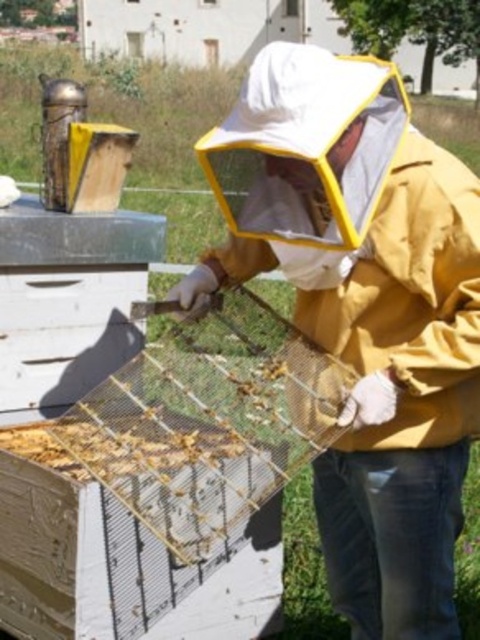
Question: Which of the following is the farthest from the observer?

Choices:
 (A) wooden frame at center
 (B) yellow matte beekeeper suit at center

Answer: (A)

Question: Does yellow matte beekeeper suit at center have a larger size compared to wooden frame at center?

Choices:
 (A) no
 (B) yes

Answer: (B)

Question: Which of the following is the farthest from the observer?

Choices:
 (A) (214, 561)
 (B) (248, 76)

Answer: (A)

Question: Which point is closer to the camera taking this photo?

Choices:
 (A) (171, 353)
 (B) (204, 273)

Answer: (B)

Question: Does yellow matte beekeeper suit at center have a larger size compared to wooden frame at center?

Choices:
 (A) no
 (B) yes

Answer: (B)

Question: Is yellow matte beekeeper suit at center closer to the viewer compared to wooden frame at center?

Choices:
 (A) yes
 (B) no

Answer: (A)